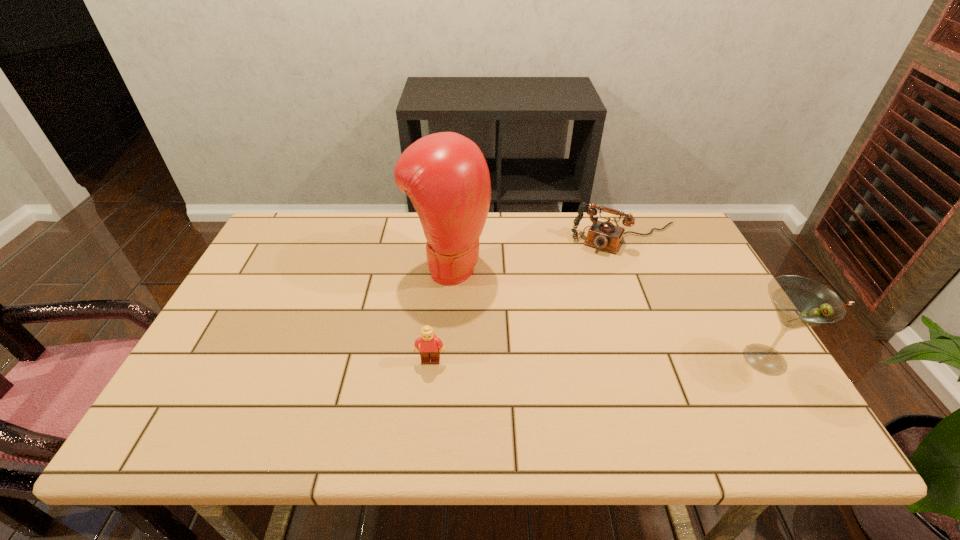
Find the location of a particular element. The height and width of the screenshot is (540, 960). free point between the tallest object and the martini is located at coordinates (607, 312).

I want to click on vacant space that is in between the Lego and the tallest object, so click(x=440, y=313).

What are the coordinates of `empty space between the Lego and the boxing glove` in the screenshot? It's located at (440, 313).

Locate an element on the screen. empty space between the telephone and the martini is located at coordinates (696, 299).

Locate an element on the screen. This screenshot has width=960, height=540. object that is the second nearest to the boxing glove is located at coordinates (605, 235).

You are a GUI agent. You are given a task and a screenshot of the screen. Output one action in this format:
    pyautogui.click(x=<x>, y=<y>)
    Task: Click on the second closest object to the telephone
    
    Given the screenshot: What is the action you would take?
    pyautogui.click(x=800, y=302)